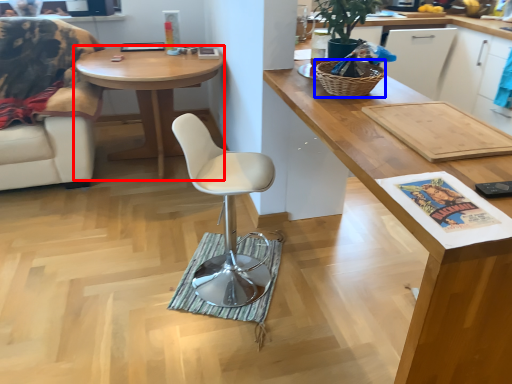
Question: Among these objects, which one is nearest to the camera, desk (highlighted by a red box) or picnic basket (highlighted by a blue box)?

Choices:
 (A) desk
 (B) picnic basket

Answer: (B)